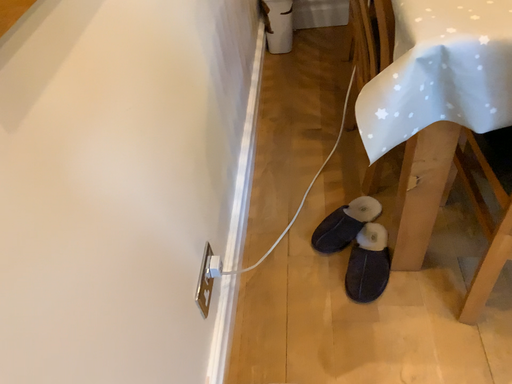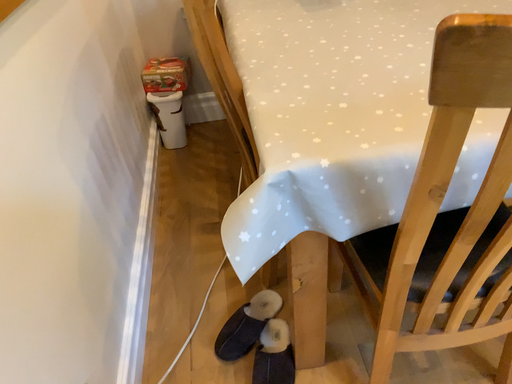
Question: Which way did the camera rotate in the video?

Choices:
 (A) rotated left
 (B) rotated right

Answer: (B)